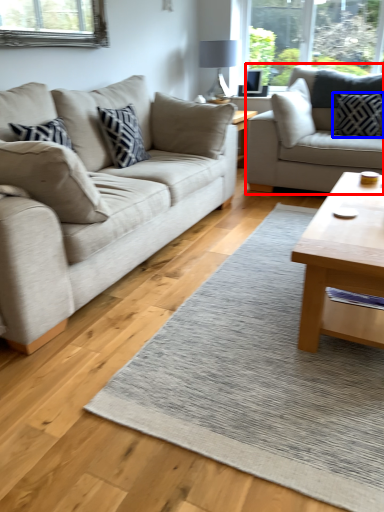
Question: Which object is closer to the camera taking this photo, studio couch (highlighted by a red box) or pillow (highlighted by a blue box)?

Choices:
 (A) studio couch
 (B) pillow

Answer: (A)